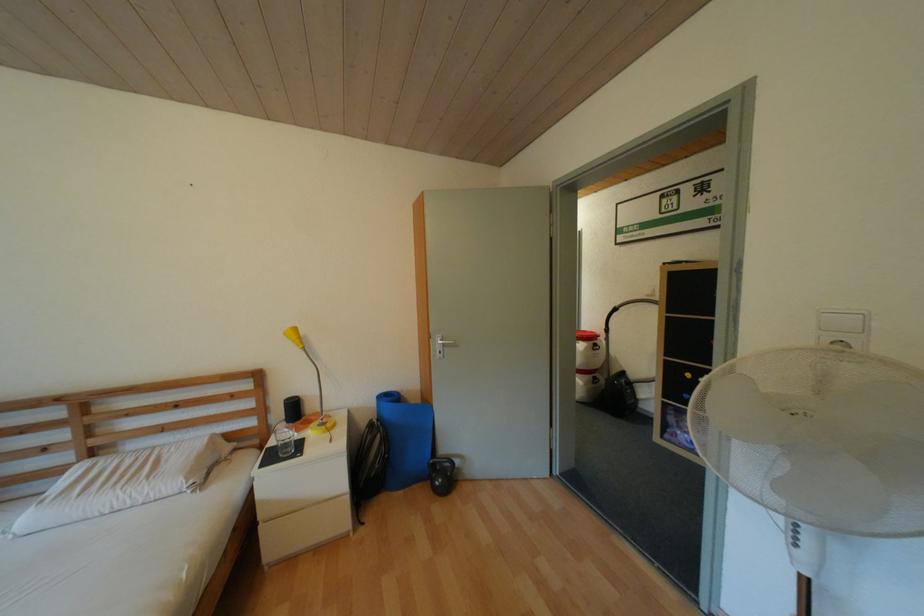
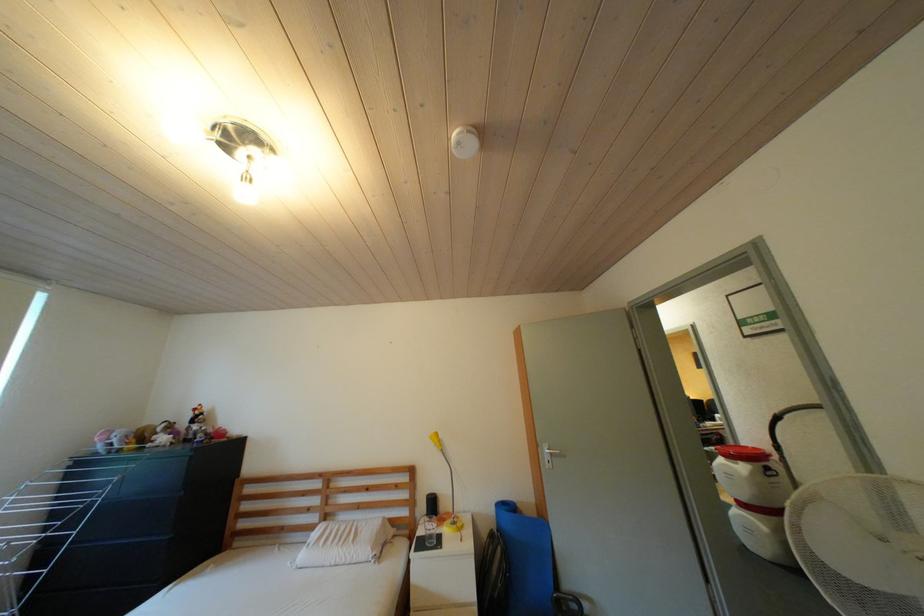
The point at (439, 338) is marked in the first image. Where is the corresponding point in the second image?

(546, 447)